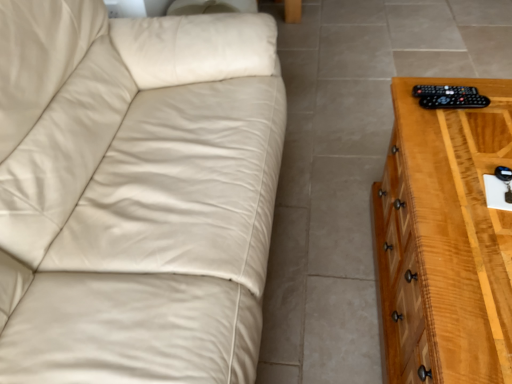
I want to click on vacant area that lies to the right of black plastic remote at right, so click(494, 107).